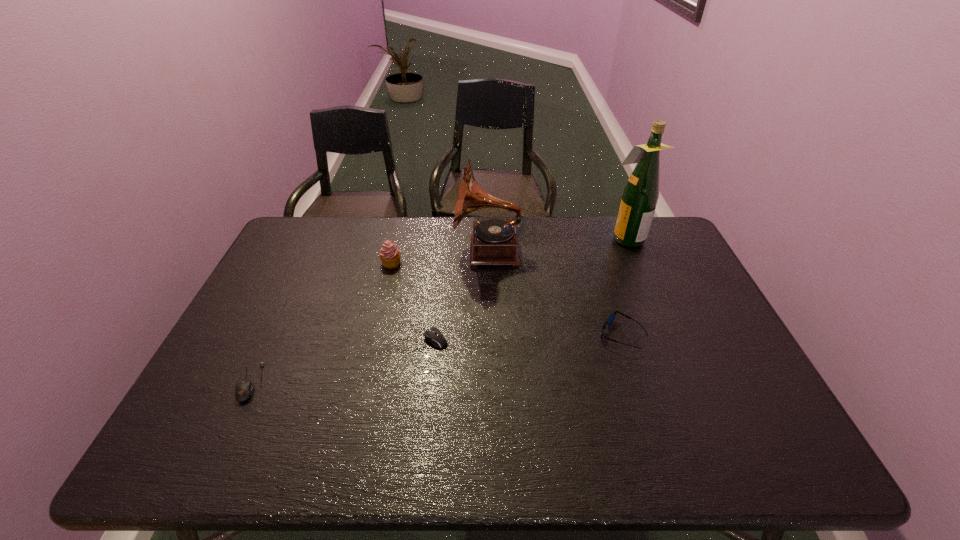
Image resolution: width=960 pixels, height=540 pixels. What are the coordinates of `vacant point at the left edge` in the screenshot? It's located at (290, 306).

The width and height of the screenshot is (960, 540). I want to click on blank space at the right edge of the desktop, so click(x=664, y=293).

The image size is (960, 540). I want to click on free spot at the far left corner of the desktop, so click(289, 230).

In the image, there is a desktop. In order to click on vacant space at the far right corner in this screenshot , I will do `click(659, 245)`.

In the image, there is a desktop. Where is `vacant area at the near right corner`? vacant area at the near right corner is located at coordinates (764, 433).

At what (x,y) coordinates should I click in order to perform the action: click on vacant point located between the leftmost object and the second object from left to right. Please return your answer as a coordinate pair (x, y). This screenshot has width=960, height=540. Looking at the image, I should click on (322, 323).

I want to click on blank region between the left mouse and the farther mouse, so click(336, 361).

Identify the location of vacant region between the nearer mouse and the liquor. (439, 310).

This screenshot has width=960, height=540. I want to click on empty space that is in between the right mouse and the sunglasses, so click(521, 338).

Where is `free space between the third tallest object and the farther mouse`? This screenshot has height=540, width=960. free space between the third tallest object and the farther mouse is located at coordinates (406, 302).